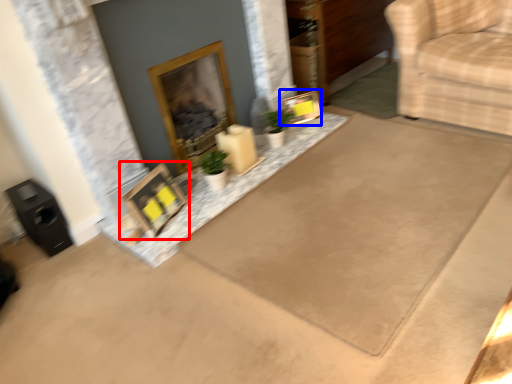
Question: Among these objects, which one is nearest to the camera, picture frame (highlighted by a red box) or picture frame (highlighted by a blue box)?

Choices:
 (A) picture frame
 (B) picture frame

Answer: (A)